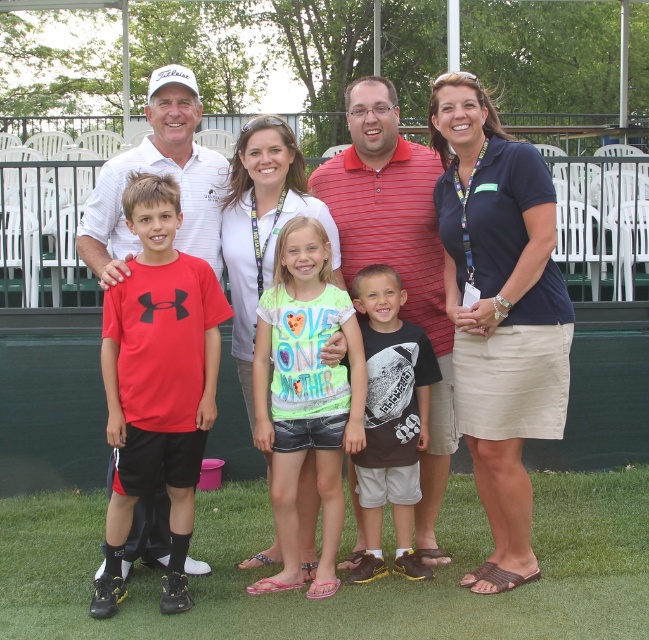
Question: Can you confirm if matte red t-shirt at center is positioned below dark brown cotton t-shirt at center?

Choices:
 (A) no
 (B) yes

Answer: (A)

Question: Which object is positioned closest to the neon green t-shirt at center?

Choices:
 (A) red matte t-shirt at center
 (B) dark brown cotton t-shirt at center

Answer: (B)

Question: Can you confirm if neon green t-shirt at center is positioned to the right of dark brown cotton t-shirt at center?

Choices:
 (A) no
 (B) yes

Answer: (A)

Question: Which point is farther from the camera taking this photo?

Choices:
 (A) click(202, 289)
 (B) click(526, 333)
 (C) click(313, 403)
 (D) click(432, 342)

Answer: (D)

Question: Based on their relative distances, which object is farther from the matte red t-shirt at center?

Choices:
 (A) dark brown cotton t-shirt at center
 (B) neon green t-shirt at center

Answer: (B)

Question: Observing the image, what is the correct spatial positioning of navy blue shirt at right in reference to dark brown cotton t-shirt at center?

Choices:
 (A) below
 (B) above

Answer: (B)